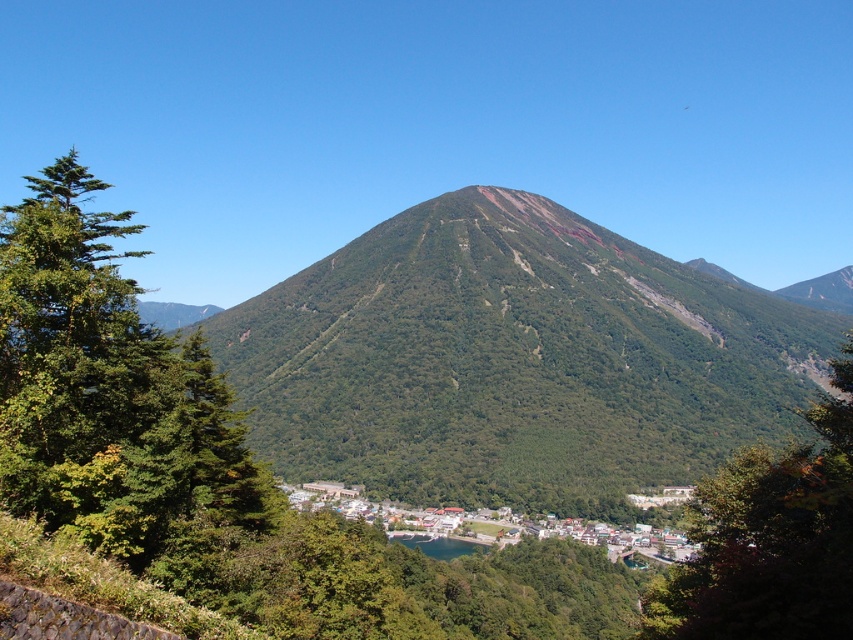
Question: Does green leafy tree at left have a smaller size compared to green leafy tree at center?

Choices:
 (A) no
 (B) yes

Answer: (B)

Question: Which of the following is the closest to the observer?

Choices:
 (A) (111, 528)
 (B) (654, 531)
 (C) (494, 502)
 (D) (817, 561)

Answer: (A)

Question: Which point is closer to the camera?

Choices:
 (A) (844, 522)
 (B) (503, 524)
 (C) (177, 438)
 (D) (798, 342)

Answer: (A)

Question: Can you confirm if green leafy tree at center is positioned to the left of green wooden houses at lower center?

Choices:
 (A) yes
 (B) no

Answer: (B)

Question: Does green leafy tree at left have a larger size compared to green leafy tree at center?

Choices:
 (A) no
 (B) yes

Answer: (A)

Question: Which of the following is the farthest from the observer?

Choices:
 (A) (683, 596)
 (B) (184, 424)
 (C) (764, 435)

Answer: (C)